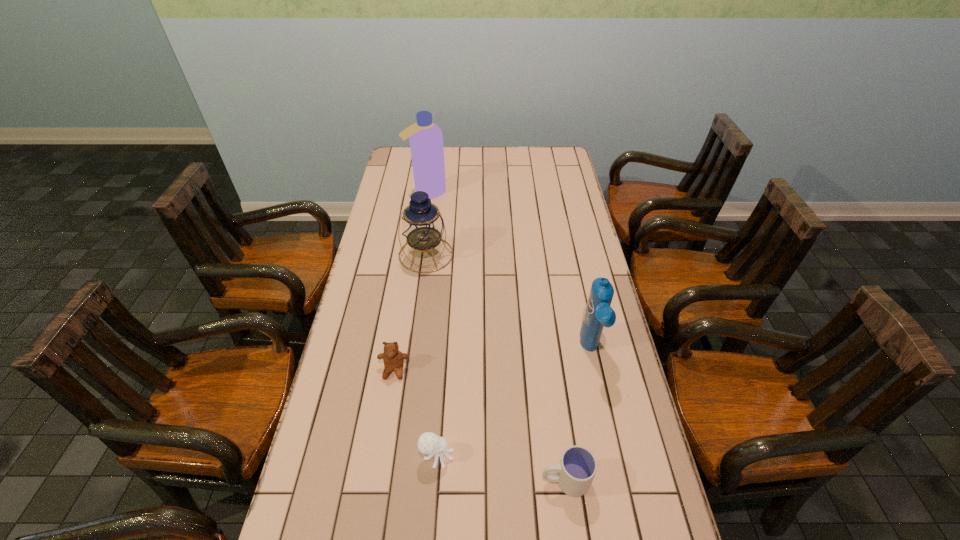
Where is `vacant area situated 0.390m on the back of the rightmost object`? vacant area situated 0.390m on the back of the rightmost object is located at coordinates click(x=568, y=248).

Identify the location of free spot located 0.160m on the face of the teddy bear. The image size is (960, 540). (384, 435).

Where is `free space located with the handle on the side of the fifth object from left to right`? The image size is (960, 540). free space located with the handle on the side of the fifth object from left to right is located at coordinates (429, 480).

The width and height of the screenshot is (960, 540). What are the coordinates of `vacant space located with the handle on the side of the fifth object from left to right` in the screenshot? It's located at (387, 480).

What are the coordinates of `free spot located 0.330m with the handle on the side of the fifth object from left to right` in the screenshot? It's located at (404, 480).

Locate an element on the screen. The height and width of the screenshot is (540, 960). vacant area located 0.220m on the front-facing side of the octopus is located at coordinates (541, 455).

Image resolution: width=960 pixels, height=540 pixels. Identify the location of shampoo that is at the left edge. click(x=426, y=139).

Locate an element on the screen. Image resolution: width=960 pixels, height=540 pixels. lantern at the left edge is located at coordinates click(422, 225).

Locate an element on the screen. This screenshot has height=540, width=960. teddy bear that is at the left edge is located at coordinates (393, 359).

Locate an element on the screen. This screenshot has height=540, width=960. shampoo that is positioned at the right edge is located at coordinates (598, 314).